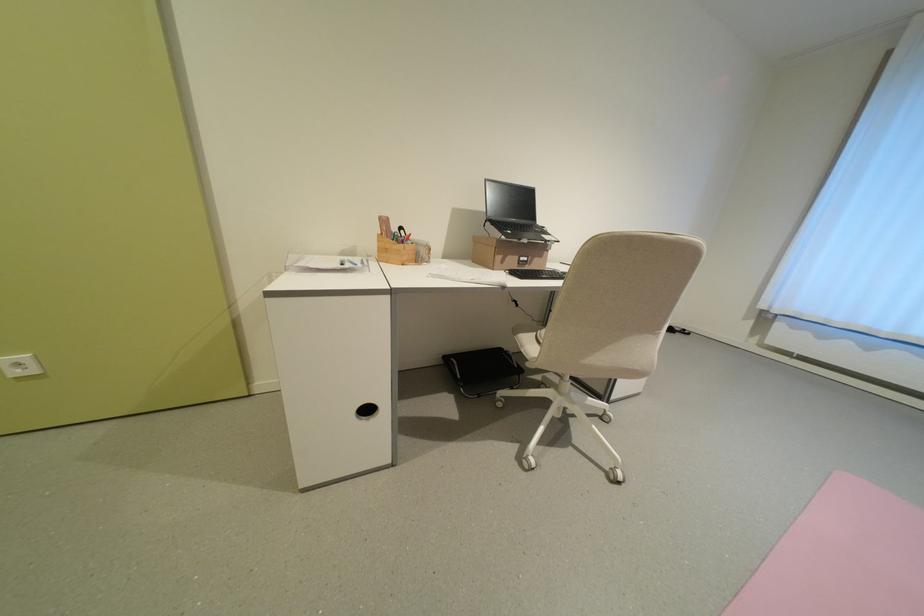
Describe the element at coordinates (20, 366) in the screenshot. I see `the white power outlet` at that location.